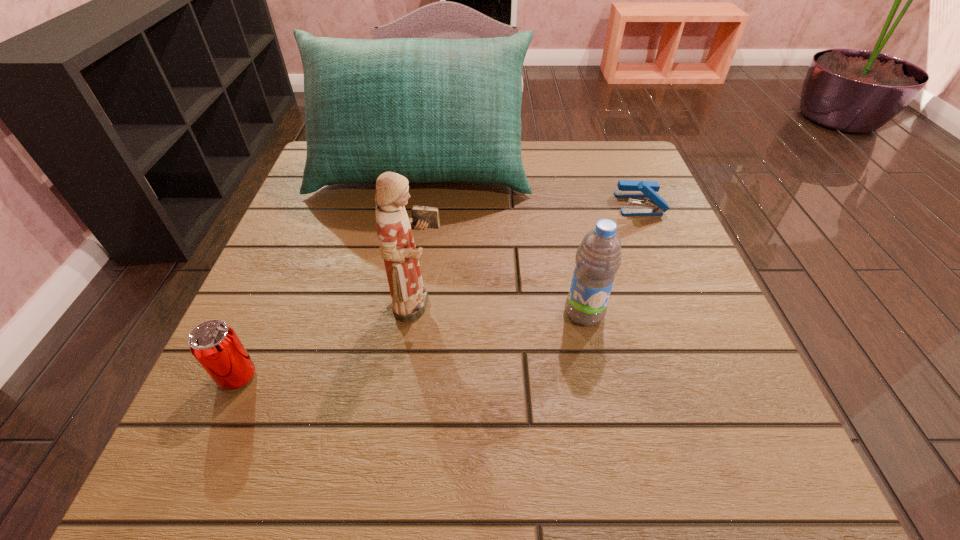
At what (x,y) coordinates should I click in order to perform the action: click on free space between the third shortest object and the cushion. Please return your answer as a coordinate pair (x, y). Image resolution: width=960 pixels, height=540 pixels. Looking at the image, I should click on (503, 242).

Locate an element on the screen. The width and height of the screenshot is (960, 540). blank region between the soda can and the cushion is located at coordinates (329, 274).

This screenshot has width=960, height=540. In order to click on empty space between the cushion and the water bottle in this screenshot , I will do `click(503, 242)`.

Locate an element on the screen. This screenshot has height=540, width=960. vacant space in between the figurine and the nearest object is located at coordinates (329, 341).

Where is `object that ranks as the third closest to the nearest object`? object that ranks as the third closest to the nearest object is located at coordinates (598, 258).

In order to click on the third closest object relative to the nearest object in this screenshot , I will do `click(598, 258)`.

Identify the location of vacant area in the image that satisfies the following two spatial constraints: 1. on the front-facing side of the figurine; 2. on the left side of the water bottle. The width and height of the screenshot is (960, 540). (420, 313).

You are a GUI agent. You are given a task and a screenshot of the screen. Output one action in this format:
    pyautogui.click(x=<x>, y=<y>)
    Task: Click on the free space that satisfies the following two spatial constraints: 1. on the front-facing side of the figurine; 2. on the back side of the water bottle
    The height and width of the screenshot is (540, 960).
    Given the screenshot: What is the action you would take?
    pyautogui.click(x=420, y=313)

This screenshot has height=540, width=960. I want to click on free space that satisfies the following two spatial constraints: 1. on the front-facing side of the cushion; 2. on the right side of the water bottle, so click(x=397, y=313).

The height and width of the screenshot is (540, 960). I want to click on free space that satisfies the following two spatial constraints: 1. on the front-facing side of the cushion; 2. on the right side of the stapler, so click(x=416, y=204).